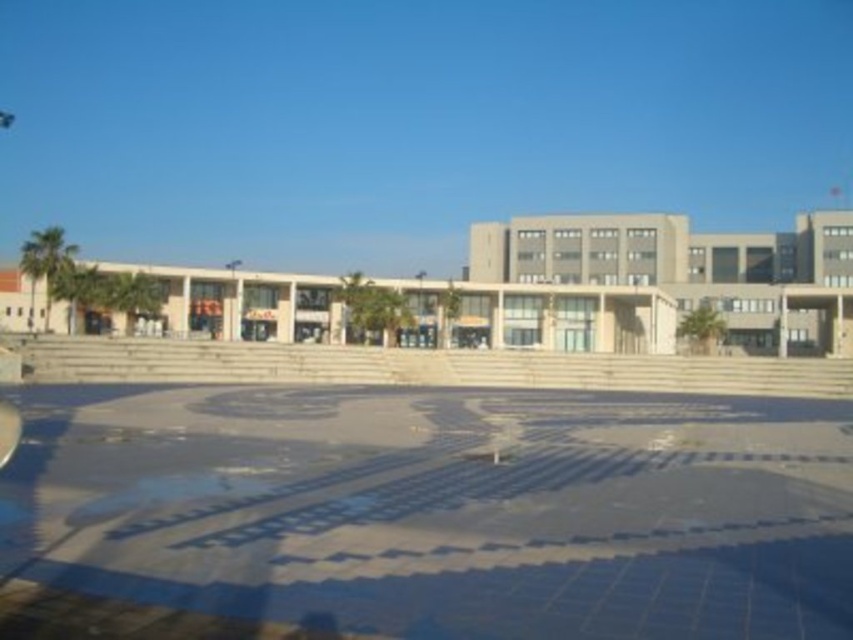
Question: Is blue mosaic tiles at center to the left of beige concrete plaza at center from the viewer's perspective?

Choices:
 (A) yes
 (B) no

Answer: (A)

Question: Can you confirm if blue mosaic tiles at center is positioned to the left of beige concrete plaza at center?

Choices:
 (A) yes
 (B) no

Answer: (A)

Question: Is blue mosaic tiles at center wider than beige concrete plaza at center?

Choices:
 (A) no
 (B) yes

Answer: (A)

Question: Which of the following is the farthest from the observer?

Choices:
 (A) (753, 289)
 (B) (206, 572)

Answer: (A)

Question: Which point appears closest to the camera in this image?

Choices:
 (A) (837, 337)
 (B) (512, 468)

Answer: (B)